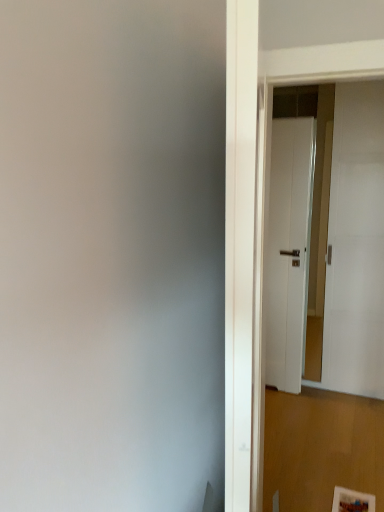
Question: Considering the positions of white matte door at right, which is the 2th door in right-to-left order, and white matte door at upper right, which is the first door from right to left, in the image, is white matte door at right, which is the 2th door in right-to-left order, taller or shorter than white matte door at upper right, which is the first door from right to left,?

Choices:
 (A) tall
 (B) short

Answer: (B)

Question: Does point (289, 188) appear closer or farther from the camera than point (324, 131)?

Choices:
 (A) farther
 (B) closer

Answer: (B)

Question: Considering the positions of white matte door at right, placed as the first door when sorted from left to right, and white matte door at upper right, the 2th door when ordered from left to right, in the image, is white matte door at right, placed as the first door when sorted from left to right, wider or thinner than white matte door at upper right, the 2th door when ordered from left to right,?

Choices:
 (A) thin
 (B) wide

Answer: (A)

Question: Which is correct: white matte door at upper right, which is the first door from right to left, is inside white matte door at right, placed as the first door when sorted from left to right, or outside of it?

Choices:
 (A) inside
 (B) outside

Answer: (B)

Question: From the image's perspective, relative to white matte door at right, placed as the first door when sorted from left to right, is white matte door at upper right, which is the first door from right to left, above or below?

Choices:
 (A) above
 (B) below

Answer: (A)

Question: Is white matte door at upper right, which is the first door from right to left, wider or thinner than white matte door at right, which is the 2th door in right-to-left order?

Choices:
 (A) thin
 (B) wide

Answer: (B)

Question: Does point (271, 166) appear closer or farther from the camera than point (281, 382)?

Choices:
 (A) closer
 (B) farther

Answer: (A)